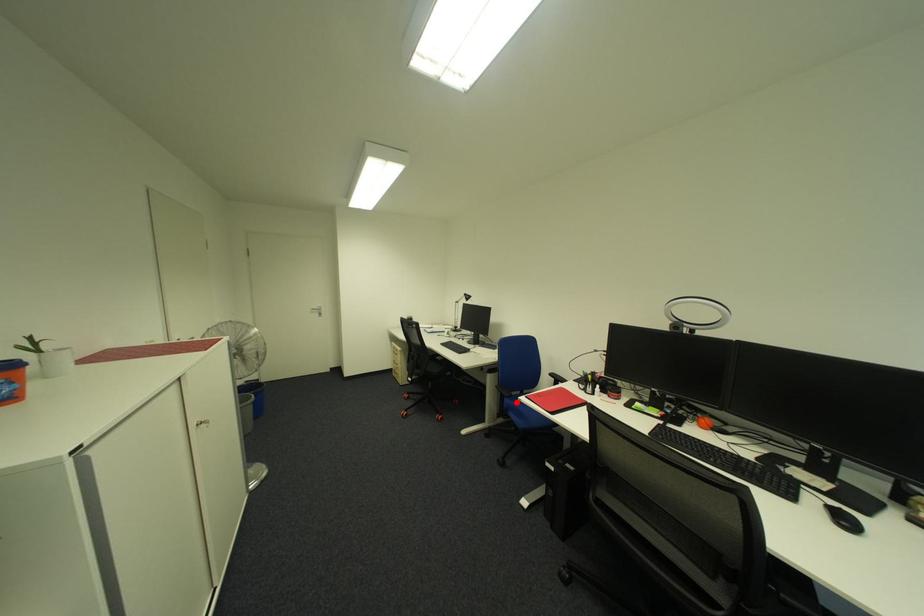
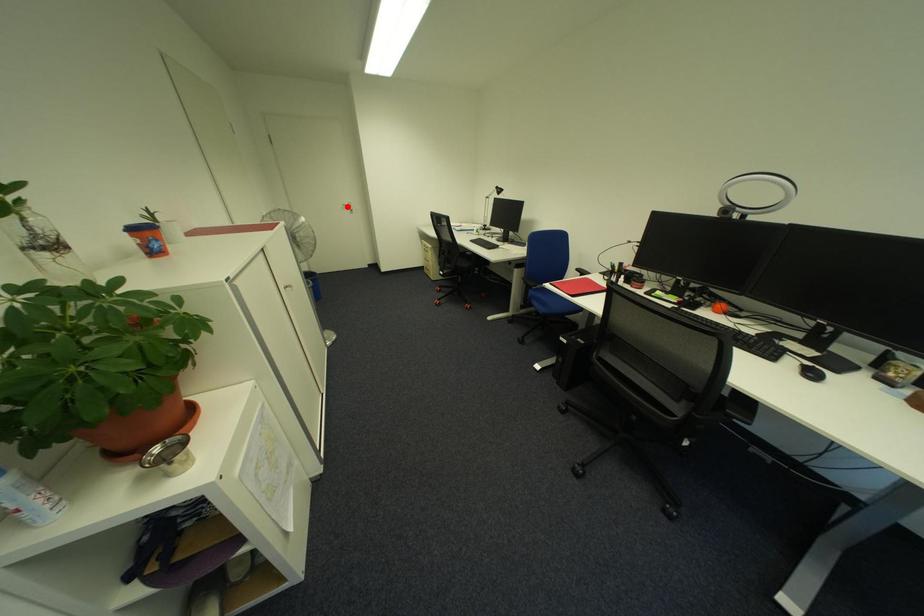
I am providing you with two images of the same scene from different viewpoints. A red point is marked on the first image and another point is marked on the second image. Is the marked point in image1 the same physical position as the marked point in image2?

No